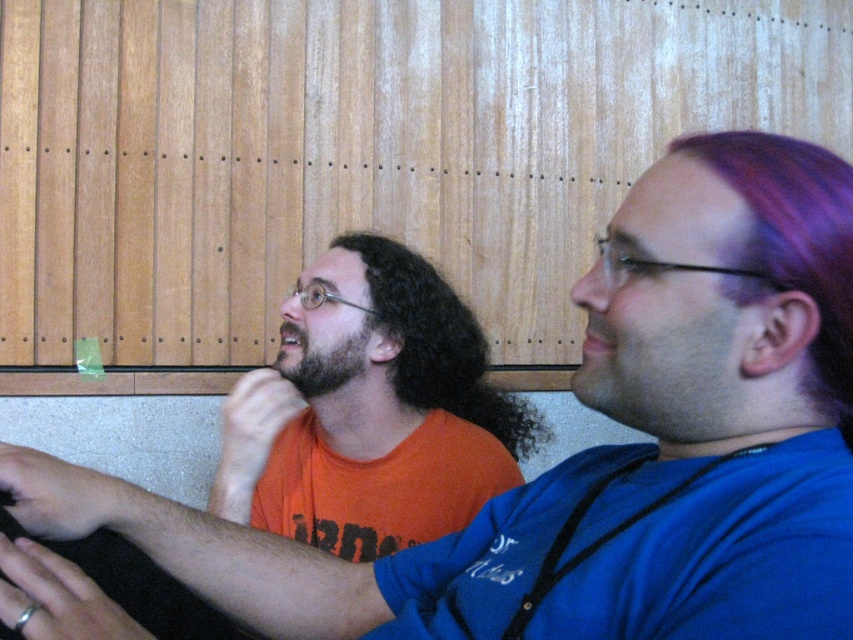
Does orange t-shirt at center lie behind curly brown hair at center?

No, it is in front of curly brown hair at center.

Which is in front, point (341, 248) or point (399, 310)?

Point (399, 310) is in front.

Between point (210, 497) and point (409, 310), which one is positioned behind?

The point (409, 310) is more distant.

You are a GUI agent. You are given a task and a screenshot of the screen. Output one action in this format:
    pyautogui.click(x=<x>, y=<y>)
    Task: Click on the orange t-shirt at center
    The height and width of the screenshot is (640, 853).
    Given the screenshot: What is the action you would take?
    pyautogui.click(x=370, y=412)

Which is behind, point (438, 300) or point (344, 374)?

The point (438, 300) is behind.

Image resolution: width=853 pixels, height=640 pixels. Find the location of `curly brown hair at center`. curly brown hair at center is located at coordinates (439, 344).

Is point (463, 356) in front of point (305, 378)?

No, it is not.

The height and width of the screenshot is (640, 853). Identify the location of curly brown hair at center. coord(439,344).

Where is `purple dyed hair at right`? This screenshot has height=640, width=853. purple dyed hair at right is located at coordinates (795, 237).

Does point (781, 141) come in front of point (432, 298)?

That is True.

The image size is (853, 640). Describe the element at coordinates (795, 237) in the screenshot. I see `purple dyed hair at right` at that location.

This screenshot has height=640, width=853. Identify the location of purple dyed hair at right. (795, 237).